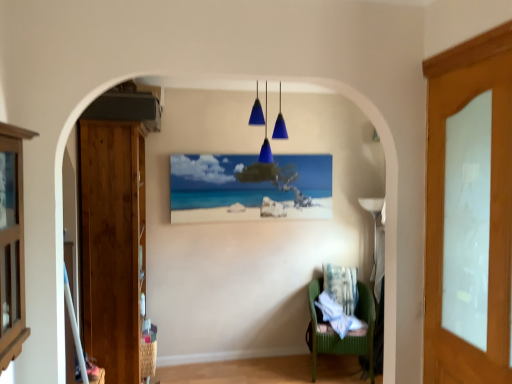
Question: Can you confirm if wooden cabinet at left is thinner than matte wooden picture frame at center?

Choices:
 (A) yes
 (B) no

Answer: (B)

Question: Is wooden cabinet at left at the left side of matte wooden picture frame at center?

Choices:
 (A) no
 (B) yes

Answer: (B)

Question: Considering the relative sizes of wooden cabinet at left and matte wooden picture frame at center in the image provided, is wooden cabinet at left taller than matte wooden picture frame at center?

Choices:
 (A) yes
 (B) no

Answer: (A)

Question: Does wooden cabinet at left have a larger size compared to matte wooden picture frame at center?

Choices:
 (A) no
 (B) yes

Answer: (A)

Question: From a real-world perspective, is wooden cabinet at left positioned over matte wooden picture frame at center based on gravity?

Choices:
 (A) no
 (B) yes

Answer: (A)

Question: Relative to green fabric chair at lower right, is wooden cabinet at left in front or behind?

Choices:
 (A) behind
 (B) front

Answer: (B)

Question: Is wooden cabinet at left wider or thinner than green fabric chair at lower right?

Choices:
 (A) wide
 (B) thin

Answer: (B)

Question: Considering the positions of wooden cabinet at left and green fabric chair at lower right in the image, is wooden cabinet at left taller or shorter than green fabric chair at lower right?

Choices:
 (A) short
 (B) tall

Answer: (B)

Question: Would you say wooden cabinet at left is to the left or to the right of green fabric chair at lower right in the picture?

Choices:
 (A) right
 (B) left

Answer: (B)

Question: Is fluffy white pillow at lower center taller or shorter than wooden door at left, which is counted as the second door, starting from the front?

Choices:
 (A) short
 (B) tall

Answer: (A)

Question: Is fluffy white pillow at lower center in front of or behind wooden door at left, acting as the second door starting from the right, in the image?

Choices:
 (A) behind
 (B) front

Answer: (A)

Question: Looking at their shapes, would you say fluffy white pillow at lower center is wider or thinner than wooden door at left, the 1th door from the back?

Choices:
 (A) wide
 (B) thin

Answer: (B)

Question: In the image, is fluffy white pillow at lower center on the left side or the right side of wooden door at left, which is counted as the second door, starting from the front?

Choices:
 (A) right
 (B) left

Answer: (A)

Question: Does point (510, 213) appear closer or farther from the camera than point (9, 173)?

Choices:
 (A) farther
 (B) closer

Answer: (A)

Question: In terms of width, does white glass door at right, which is the second door in left-to-right order, look wider or thinner when compared to wooden cabinet at left?

Choices:
 (A) thin
 (B) wide

Answer: (A)